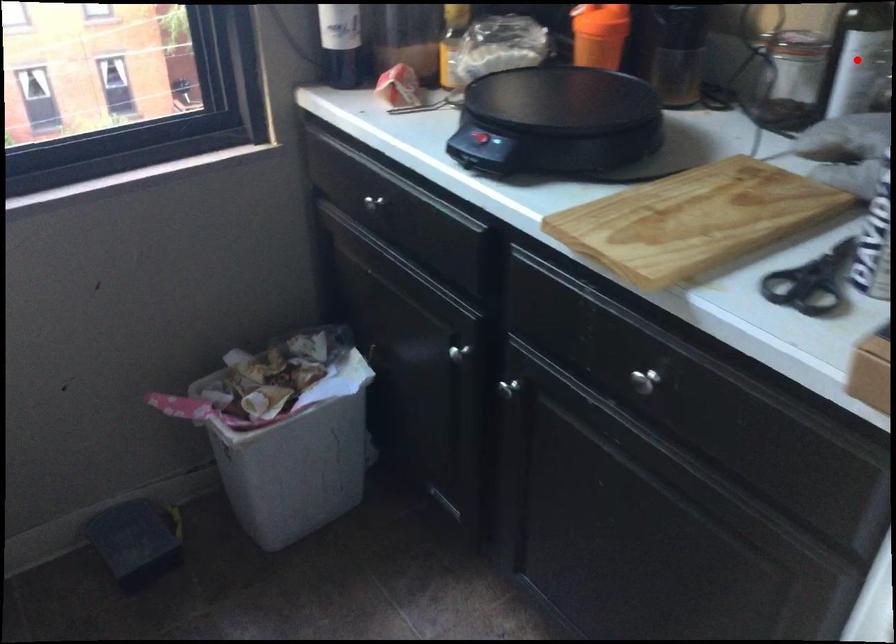
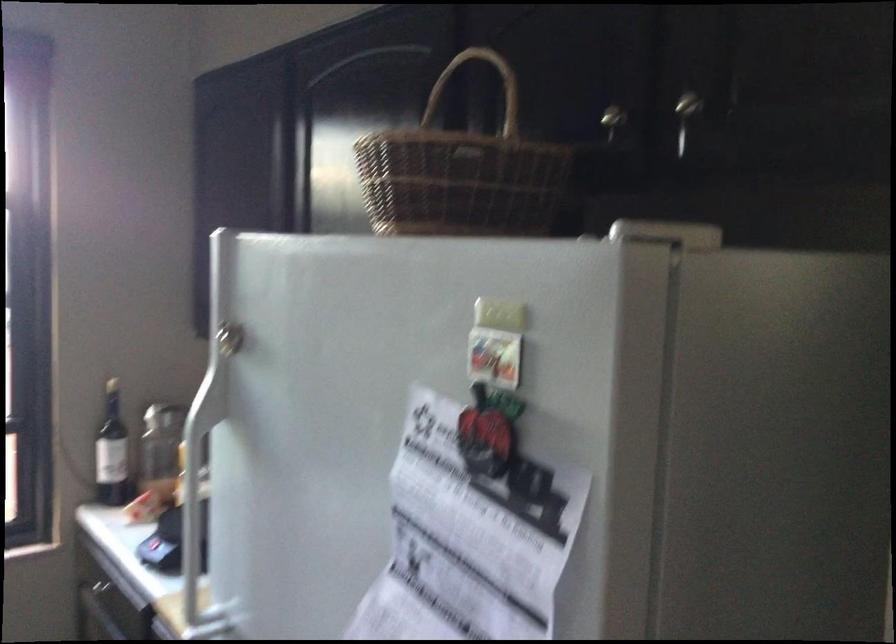
Question: I am providing you with two images of the same scene from different viewpoints. A red point is marked on the first image. Is the red point's position out of view in image 2?

Choices:
 (A) Yes
 (B) No

Answer: (A)